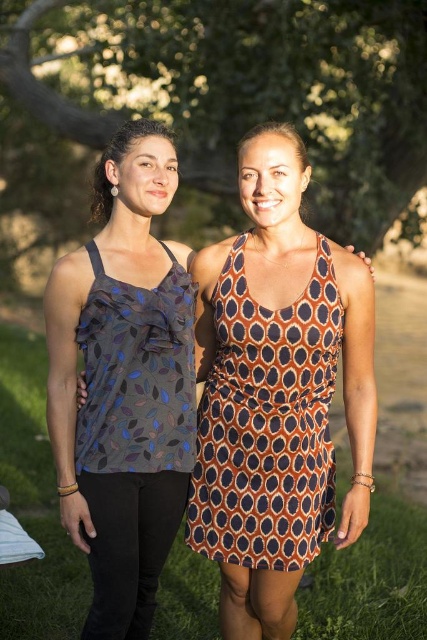
Question: Observing the image, what is the correct spatial positioning of green leafy tree at upper center in reference to green grass at center?

Choices:
 (A) above
 (B) below

Answer: (A)

Question: Among these points, which one is farthest from the camera?

Choices:
 (A) (131, 128)
 (B) (160, 486)

Answer: (B)

Question: Does orange dotted fabric dress at center have a larger size compared to printed fabric tank top at left?

Choices:
 (A) no
 (B) yes

Answer: (B)

Question: Is green leafy tree at upper center wider than matte gray tank top at upper left?

Choices:
 (A) no
 (B) yes

Answer: (B)

Question: Which point is closer to the camera taking this photo?

Choices:
 (A) (139, 412)
 (B) (25, 356)

Answer: (A)

Question: Which of the following is the closest to the observer?

Choices:
 (A) (301, 129)
 (B) (251, 310)

Answer: (B)